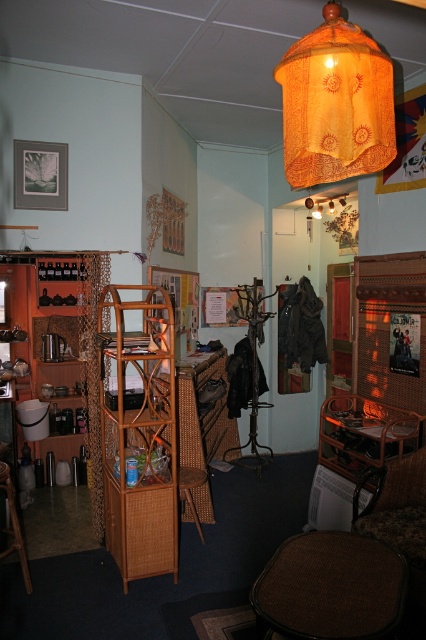
Is woven rattan shelf at left taller than brown woven chair at lower right?

Indeed, woven rattan shelf at left has a greater height compared to brown woven chair at lower right.

Can you confirm if woven rattan shelf at left is positioned to the left of brown woven chair at lower right?

Yes, woven rattan shelf at left is to the left of brown woven chair at lower right.

Is point (169, 300) more distant than point (405, 467)?

Yes, point (169, 300) is farther from viewer.

Find the location of a particular element. The image size is (426, 640). woven rattan shelf at left is located at coordinates (141, 438).

Find the location of a particular element. The image size is (426, 640). orange fabric lampshade at upper center is located at coordinates (336, 104).

Which is in front, point (313, 118) or point (0, 484)?

Point (313, 118) is more forward.

At what (x,y) coordinates should I click in order to perform the action: click on orange fabric lampshade at upper center. Please return your answer as a coordinate pair (x, y). The width and height of the screenshot is (426, 640). Looking at the image, I should click on (336, 104).

Does woven rattan shelf at left appear on the left side of orange fabric lampshade at upper center?

Yes, woven rattan shelf at left is to the left of orange fabric lampshade at upper center.

This screenshot has height=640, width=426. Find the location of `woven rattan shelf at left`. woven rattan shelf at left is located at coordinates (141, 438).

Does point (132, 516) come farther from viewer compared to point (310, 83)?

Yes, point (132, 516) is farther from viewer.

Identify the location of woven rattan shelf at left. (141, 438).